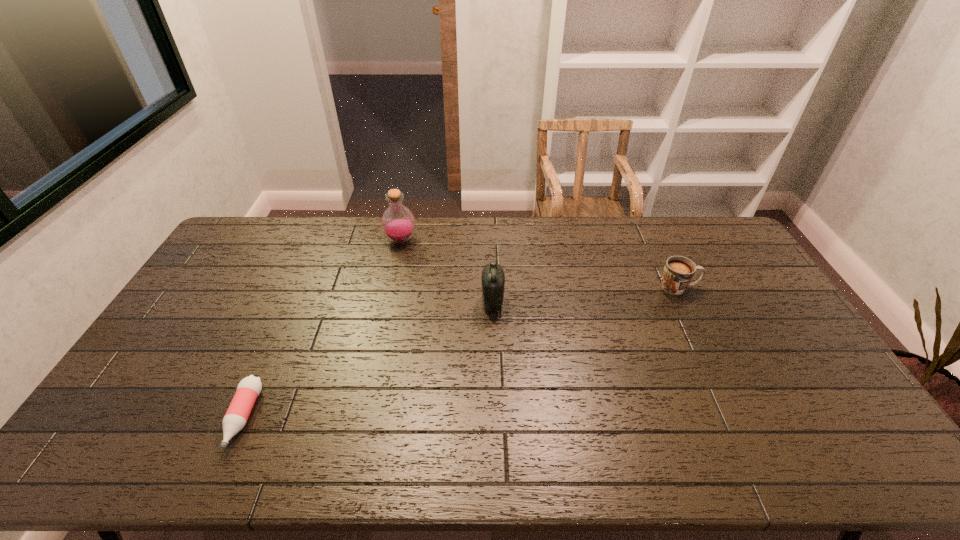
Select which bottle is the closest to the rightmost object. Please provide its 2D coordinates. Your answer should be formatted as a tuple, i.e. [(x, y)], where the tuple contains the x and y coordinates of a point satisfying the conditions above.

[(493, 278)]

You are a GUI agent. You are given a task and a screenshot of the screen. Output one action in this format:
    pyautogui.click(x=<x>, y=<y>)
    Task: Click on the blank space that satisfies the following two spatial constraints: 1. on the side of the rightmost object with the handle; 2. with the cap open on the nearest bottle
    This screenshot has width=960, height=540.
    Given the screenshot: What is the action you would take?
    pyautogui.click(x=742, y=417)

This screenshot has width=960, height=540. What are the coordinates of `free point that satisfies the following two spatial constraints: 1. on the side of the mug with the handle; 2. with the cap open on the leftmost object` in the screenshot? It's located at (742, 417).

Image resolution: width=960 pixels, height=540 pixels. In order to click on free location that satisfies the following two spatial constraints: 1. on the side of the rightmost object with the handle; 2. with the cap open on the leftmost object in this screenshot , I will do `click(742, 417)`.

Find the location of a particular element. The height and width of the screenshot is (540, 960). free point that satisfies the following two spatial constraints: 1. on the side of the mug with the handle; 2. with the cap open on the shortest object is located at coordinates (742, 417).